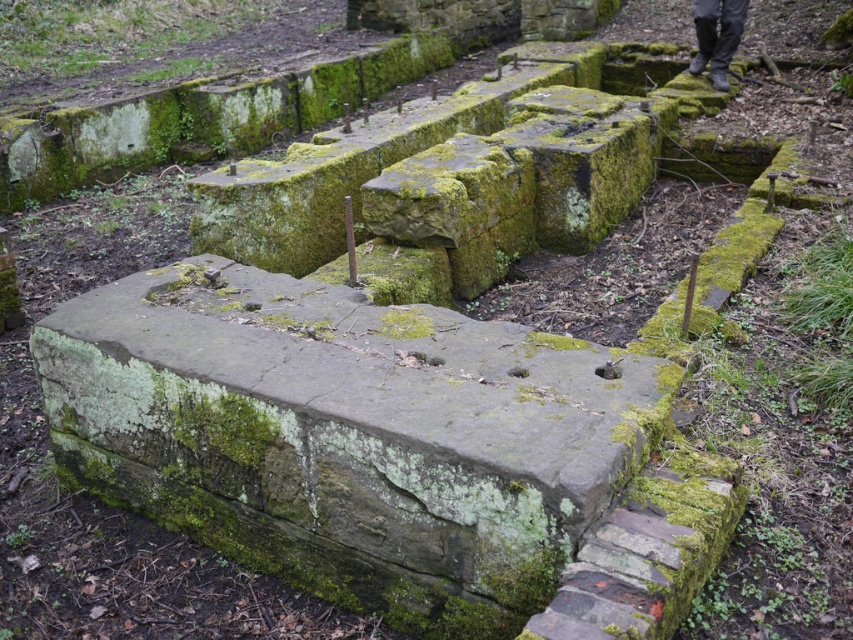
Question: Which point appears farthest from the camera in this image?

Choices:
 (A) (703, 29)
 (B) (219, 442)

Answer: (A)

Question: Is green mossy stone at center above dark gray pants at upper right?

Choices:
 (A) yes
 (B) no

Answer: (B)

Question: In this image, where is green mossy stone at center located relative to dark gray pants at upper right?

Choices:
 (A) above
 (B) below

Answer: (B)

Question: Does green mossy stone at center appear on the right side of dark gray pants at upper right?

Choices:
 (A) no
 (B) yes

Answer: (A)